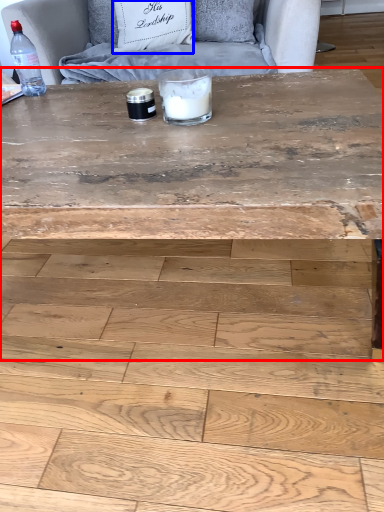
Question: Which point is further to the camera, coffee table (highlighted by a red box) or pillow (highlighted by a blue box)?

Choices:
 (A) coffee table
 (B) pillow

Answer: (B)